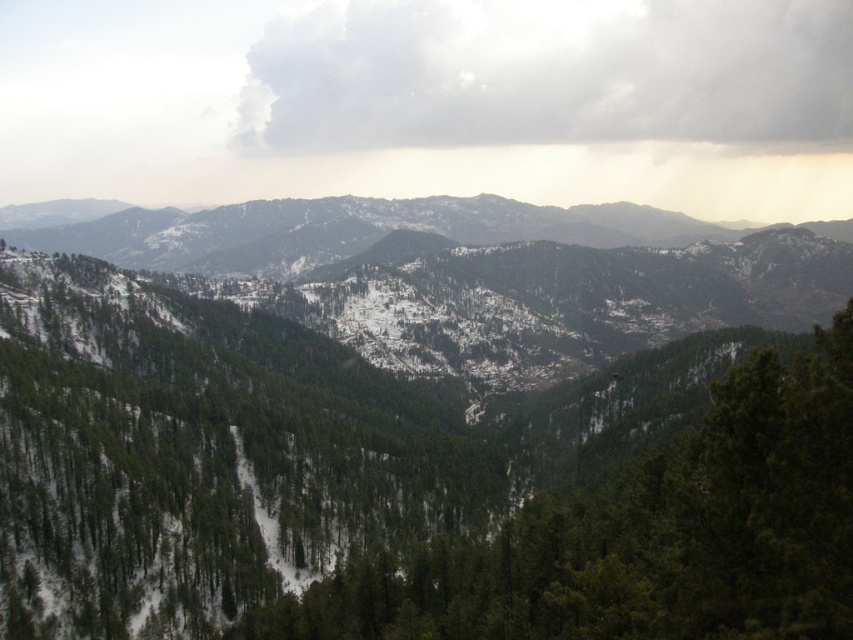
Based on the photo, you are a hiker who wants to reach the summit of the mountain. You have a map that shows the green matte tree at center. According to the map, where is the green matte tree located in coordinates?

The green matte tree at center is located at coordinates point (x=645, y=536).

You are a hiker trying to navigate through the mountainous terrain. You have two landmarks marked on your map as point coordinates. Which of the two points, point (550,625) or point (415,97), is closer to your current position?

Point (550,625) is closer to the camera than point (415,97), so it is closer to your current position.

You are an airplane pilot flying over a mountainous region. You notice a white fluffy cloud at upper center and a snowy forested mountain range at center. Which object is higher in the sky?

The white fluffy cloud at upper center is taller than the snowy forested mountain range at center, so the cloud is higher in the sky.